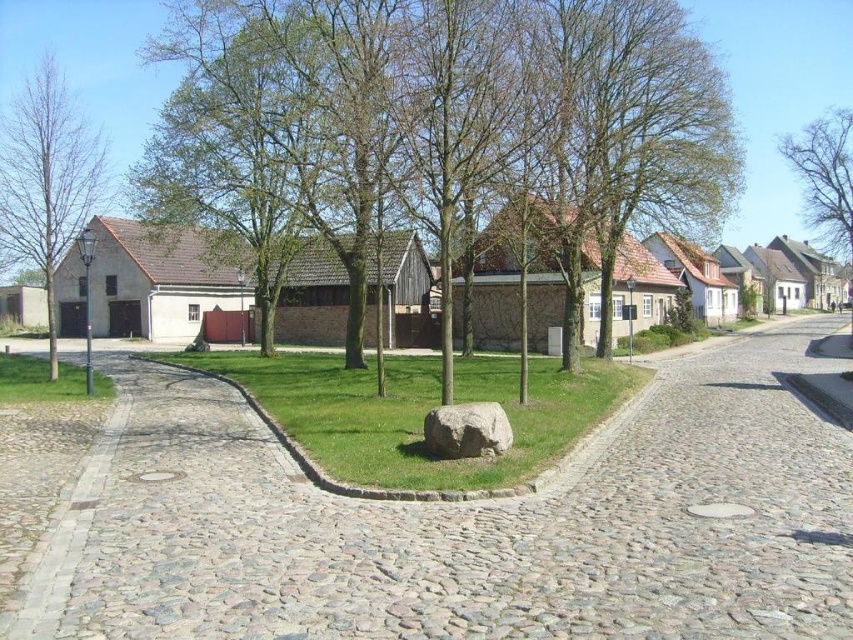
Does cobblestone path at center appear under gray rough stone at center?

Indeed, cobblestone path at center is positioned under gray rough stone at center.

Which is behind, point (502, 636) or point (463, 440)?

Positioned behind is point (463, 440).

Image resolution: width=853 pixels, height=640 pixels. In order to click on cobblestone path at center in this screenshot , I will do `click(438, 522)`.

Is point (364, 225) less distant than point (16, 369)?

That is True.

Can you confirm if green leafy tree at center is thinner than green grass at lower left?

In fact, green leafy tree at center might be wider than green grass at lower left.

Is point (572, 212) behind point (16, 380)?

No, (572, 212) is in front of (16, 380).

Find the location of `green leafy tree at center`. green leafy tree at center is located at coordinates (488, 115).

Is brown/rough tree at left behind bare branches at upper right?

No.

Is brown/rough tree at left shorter than bare branches at upper right?

Incorrect, brown/rough tree at left's height does not fall short of bare branches at upper right's.

Describe the element at coordinates (45, 179) in the screenshot. I see `brown/rough tree at left` at that location.

Image resolution: width=853 pixels, height=640 pixels. I want to click on brown/rough tree at left, so click(x=45, y=179).